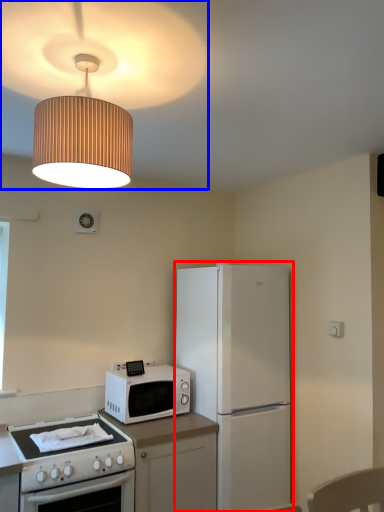
Question: Which object appears farthest to the camera in this image, refrigerator (highlighted by a red box) or lamp (highlighted by a blue box)?

Choices:
 (A) refrigerator
 (B) lamp

Answer: (A)